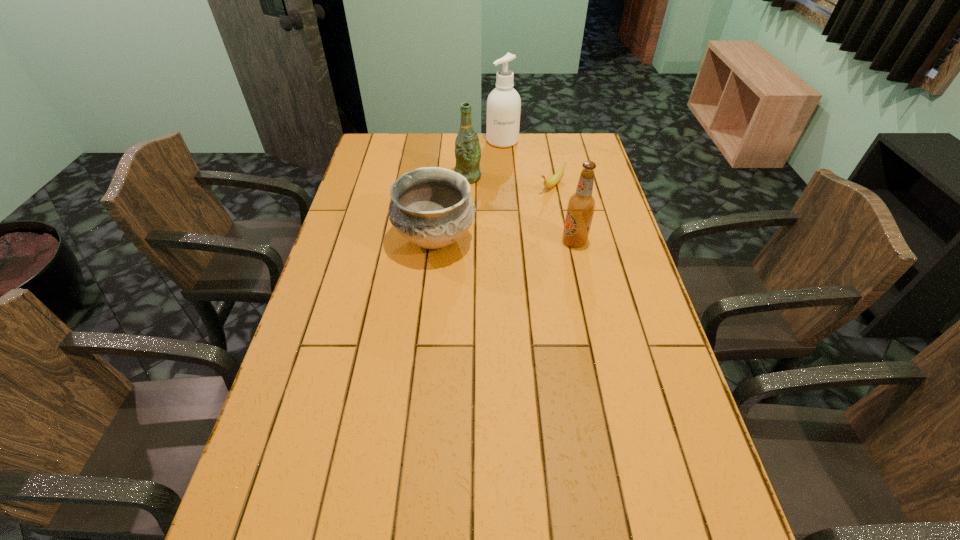
The height and width of the screenshot is (540, 960). Identify the location of blank region between the left beer bottle and the shortest object. (510, 181).

Find the location of a particular element. Image resolution: width=960 pixels, height=540 pixels. free space between the cleansing agent and the right beer bottle is located at coordinates [x=539, y=191].

At what (x,y) coordinates should I click in order to perform the action: click on free space that is in between the second shortest object and the nearer beer bottle. Please return your answer as a coordinate pair (x, y). This screenshot has height=540, width=960. Looking at the image, I should click on (505, 240).

The height and width of the screenshot is (540, 960). In order to click on object that is the fourth closest to the tallest object in this screenshot , I will do `click(581, 205)`.

Identify the location of object identified as the fourth closest to the shortest object. (431, 207).

The height and width of the screenshot is (540, 960). What are the coordinates of `vacant space that satisfies the following two spatial constraints: 1. on the front side of the nearer beer bottle; 2. on the front label of the second shortest object` in the screenshot? It's located at (435, 241).

What are the coordinates of `free space that satisfies the following two spatial constraints: 1. on the front side of the farther beer bottle; 2. on the right side of the banana` in the screenshot? It's located at (468, 185).

At what (x,y) coordinates should I click in order to perform the action: click on vacant area in the image that satisfies the following two spatial constraints: 1. on the back side of the farther beer bottle; 2. on the right side of the second shortest object. Please return your answer as a coordinate pair (x, y). This screenshot has height=540, width=960. Looking at the image, I should click on (442, 177).

Where is `vacant region that satisfies the following two spatial constraints: 1. on the front side of the nearer beer bottle; 2. on the front label of the banana`? This screenshot has width=960, height=540. vacant region that satisfies the following two spatial constraints: 1. on the front side of the nearer beer bottle; 2. on the front label of the banana is located at coordinates (564, 241).